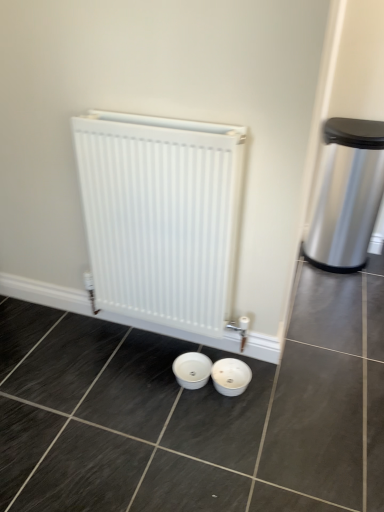
I want to click on vacant area to the right of white glossy basin at center, so pyautogui.click(x=287, y=387).